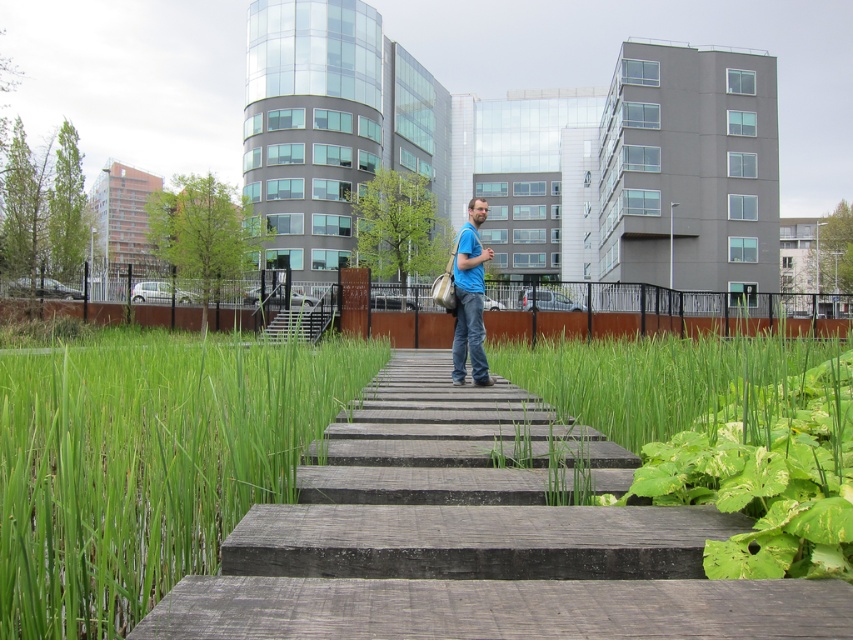
Is green leafy grass at center positioned behind blue fabric bag at center?

That is False.

Locate an element on the screen. The image size is (853, 640). green leafy grass at center is located at coordinates (724, 436).

Is blue fabric bag at center positioned at the back of wooden stairs at center?

Yes, it is behind wooden stairs at center.

The image size is (853, 640). What are the coordinates of `blue fabric bag at center` in the screenshot? It's located at (469, 298).

Is green leafy grass at center taller than wooden stairs at center?

→ No.

Is green leafy grass at center below wooden stairs at center?

Correct, green leafy grass at center is located below wooden stairs at center.

Is point (769, 468) less distant than point (302, 321)?

Yes, point (769, 468) is closer to viewer.

Find the location of `green leafy grass at center`. green leafy grass at center is located at coordinates (724, 436).